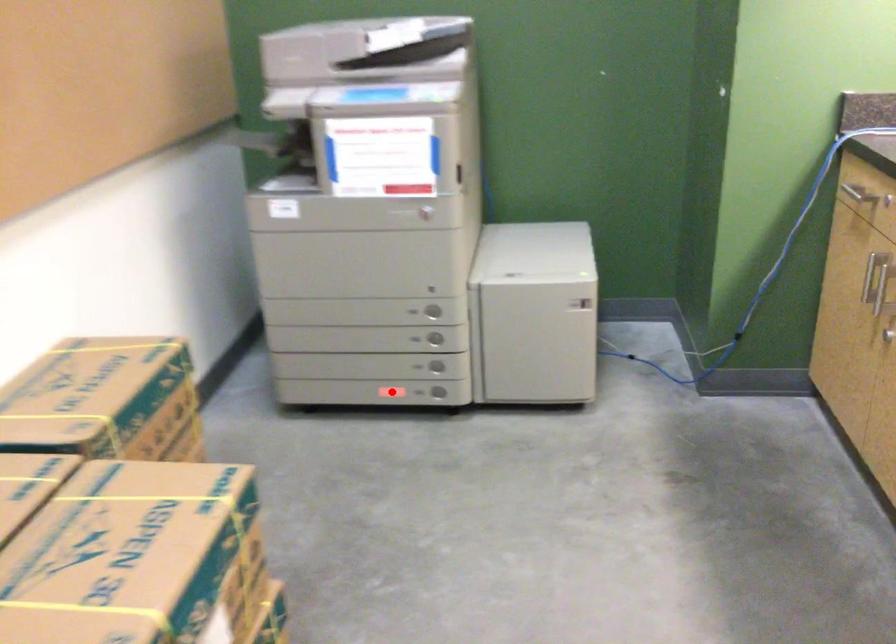
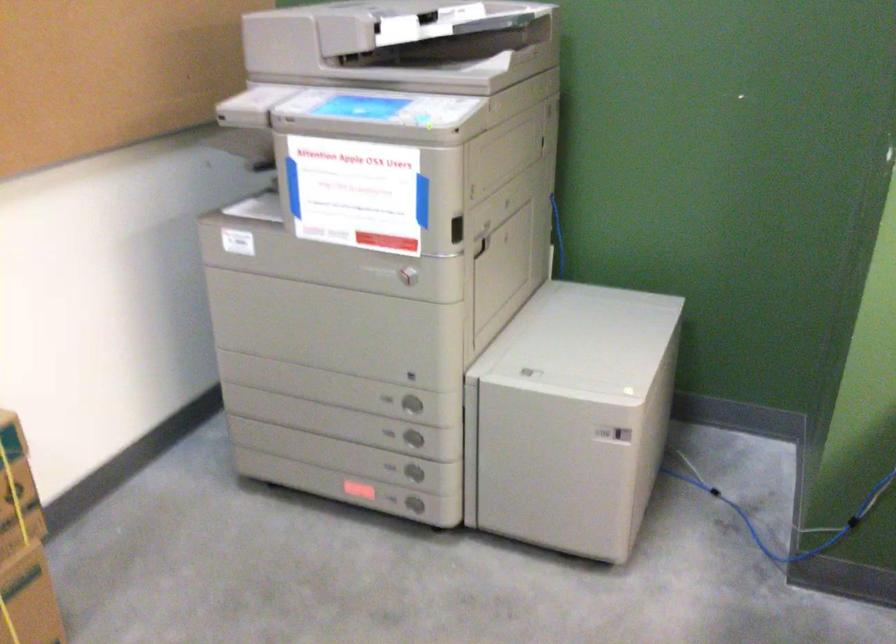
The point at the highlighted location is marked in the first image. Where is the corresponding point in the second image?

(358, 489)